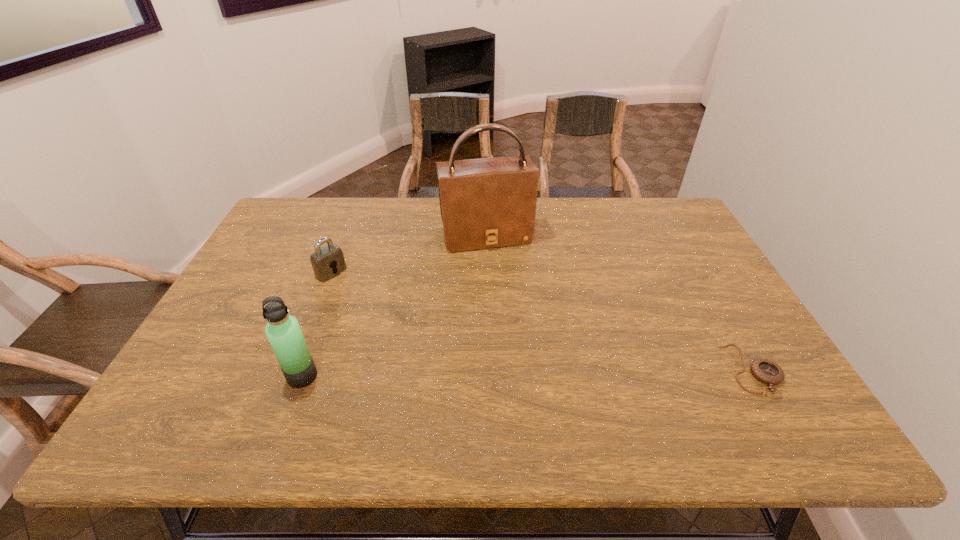
Identify the location of vacant space on the desktop that is between the second tallest object and the pocket watch and is positioned at the front of the second shortest object near the keyhole. Image resolution: width=960 pixels, height=540 pixels. (479, 374).

Where is `free space on the desktop that is between the second tallest object and the pocket watch and is positioned on the front flap of the second object from right to left`? Image resolution: width=960 pixels, height=540 pixels. free space on the desktop that is between the second tallest object and the pocket watch and is positioned on the front flap of the second object from right to left is located at coordinates (530, 373).